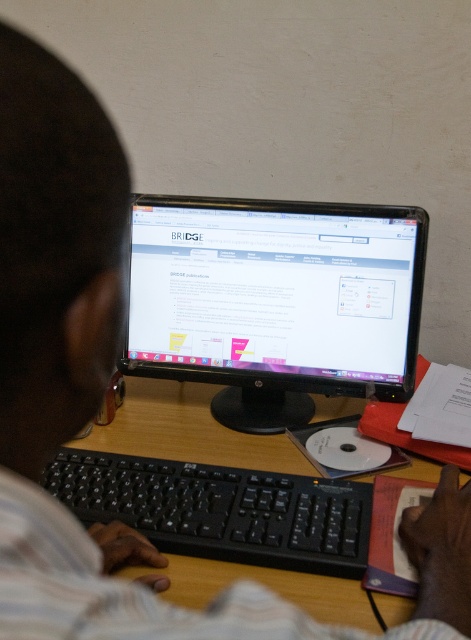
You are a person who wants to type on the keyboard without moving the monitor. Can you reach the black plastic keyboard at lower center from your current position in front of the black glossy monitor at center?

The black plastic keyboard at lower center is behind the black glossy monitor at center, so you cannot reach it without moving the monitor.

You are trying to set up a new keyboard next to the black glossy monitor at center. According to the coordinates provided, where should you place the new keyboard relative to the monitor?

The black glossy monitor at center is located at point (275, 301). Since the keyboard should be placed to the right of the monitor, you should position the new keyboard to the right of the black glossy monitor at center based on the coordinates.

You are setting up a new desk in your office and want to place a black glossy monitor at center exactly at point 0.472, 0.584. The desk is 1.5 meters wide and 0.8 meters deep. Can you confirm if the monitor will fit within the desk dimensions?

The black glossy monitor at center is positioned at point (275, 301). Since the desk is 1.5 meters wide and 0.8 meters deep, the monitor will fit within the desk dimensions as long as its physical size does not exceed the available space at that coordinate.